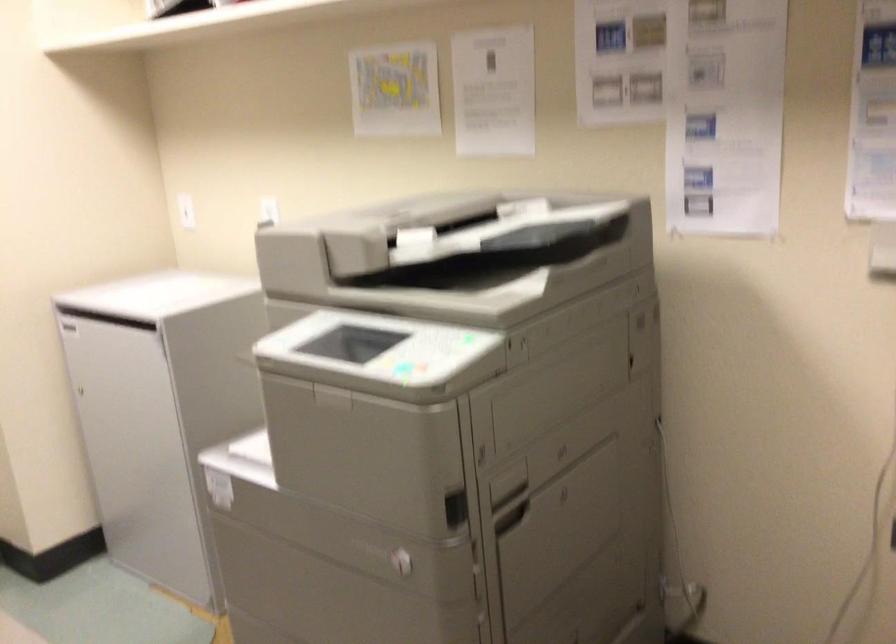
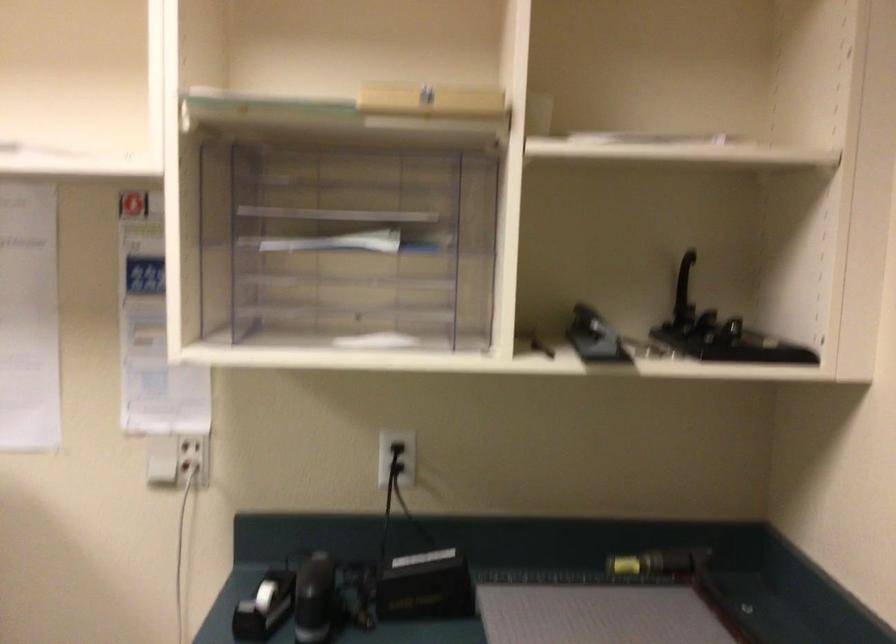
Question: The camera is either moving clockwise (left) or counter-clockwise (right) around the object. The first image is from the beginning of the video and the second image is from the end. Is the camera moving left or right when shooting the video?

Choices:
 (A) Left
 (B) Right

Answer: (A)